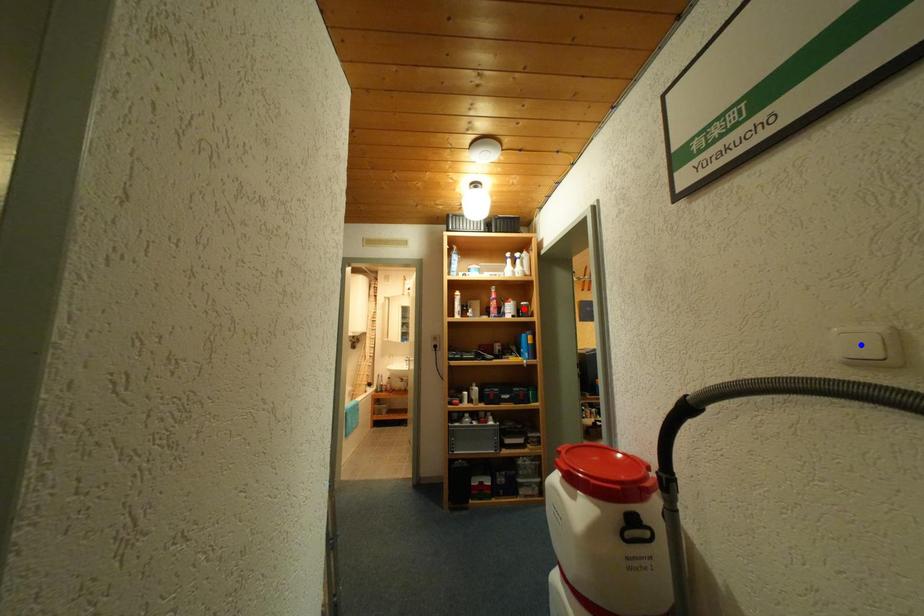
Question: In the image, two points are highlighted. Which point is nearer to the camera? Reply with the corresponding letter.

Choices:
 (A) blue point
 (B) red point

Answer: (A)